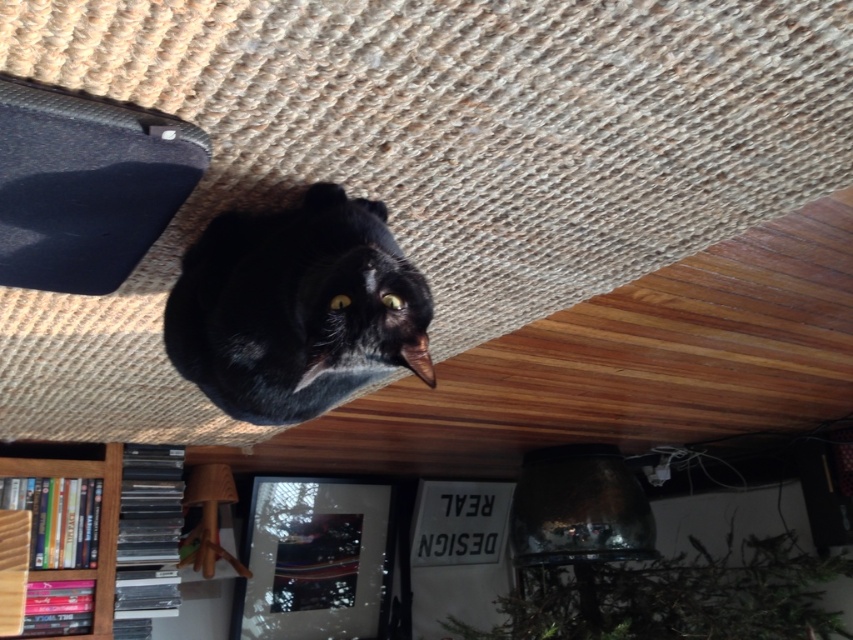
Question: Can you confirm if black matte cat at center is smaller than wooden bookshelf at lower left?

Choices:
 (A) yes
 (B) no

Answer: (B)

Question: Which point is closer to the camera?

Choices:
 (A) black matte cat at center
 (B) wooden bookshelf at lower left

Answer: (A)

Question: Which point is closer to the camera?

Choices:
 (A) (270, 358)
 (B) (108, 595)

Answer: (A)

Question: Does black matte cat at center appear under wooden bookshelf at lower left?

Choices:
 (A) yes
 (B) no

Answer: (B)

Question: Which point is farther from the camera taking this photo?

Choices:
 (A) (283, 412)
 (B) (0, 470)

Answer: (B)

Question: Can you confirm if black matte cat at center is thinner than wooden bookshelf at lower left?

Choices:
 (A) yes
 (B) no

Answer: (B)